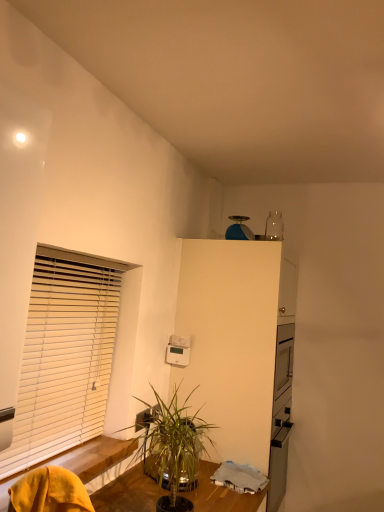
Question: Is blue matte ball at upper center, which is counted as the first appliance, starting from the right, positioned with its back to white plastic thermostat at center, the second appliance positioned from the top?

Choices:
 (A) yes
 (B) no

Answer: (B)

Question: Is blue matte ball at upper center, which is counted as the first appliance, starting from the right, in front of white plastic thermostat at center, the second appliance positioned from the top?

Choices:
 (A) yes
 (B) no

Answer: (B)

Question: Is blue matte ball at upper center, arranged as the 1th appliance when viewed from the top, positioned far away from white plastic thermostat at center, which ranks as the 1th appliance in left-to-right order?

Choices:
 (A) no
 (B) yes

Answer: (A)

Question: Is blue matte ball at upper center, marked as the second appliance in a left-to-right arrangement, wider than white plastic thermostat at center, the second appliance positioned from the top?

Choices:
 (A) no
 (B) yes

Answer: (B)

Question: Can you confirm if blue matte ball at upper center, which is counted as the first appliance, starting from the right, is bigger than white plastic thermostat at center, which ranks as the 1th appliance in left-to-right order?

Choices:
 (A) no
 (B) yes

Answer: (B)

Question: Is blue matte ball at upper center, arranged as the 2th appliance when ordered from the bottom, facing towards white plastic thermostat at center, positioned as the second appliance in right-to-left order?

Choices:
 (A) no
 (B) yes

Answer: (A)

Question: Does yellow fabric swivel chair at lower left have a lesser width compared to white plastic thermostat at center, the second appliance positioned from the top?

Choices:
 (A) yes
 (B) no

Answer: (B)

Question: Does yellow fabric swivel chair at lower left touch white plastic thermostat at center, positioned as the 1th appliance in bottom-to-top order?

Choices:
 (A) no
 (B) yes

Answer: (A)

Question: From the image's perspective, is yellow fabric swivel chair at lower left above white plastic thermostat at center, positioned as the 1th appliance in bottom-to-top order?

Choices:
 (A) yes
 (B) no

Answer: (B)

Question: Does yellow fabric swivel chair at lower left have a smaller size compared to white plastic thermostat at center, positioned as the second appliance in right-to-left order?

Choices:
 (A) no
 (B) yes

Answer: (A)

Question: Is yellow fabric swivel chair at lower left outside of white plastic thermostat at center, the second appliance positioned from the top?

Choices:
 (A) yes
 (B) no

Answer: (A)

Question: Would you consider yellow fabric swivel chair at lower left to be distant from white plastic thermostat at center, which ranks as the 1th appliance in left-to-right order?

Choices:
 (A) yes
 (B) no

Answer: (A)

Question: Is yellow fabric swivel chair at lower left oriented towards green leafy plant at lower center?

Choices:
 (A) yes
 (B) no

Answer: (B)